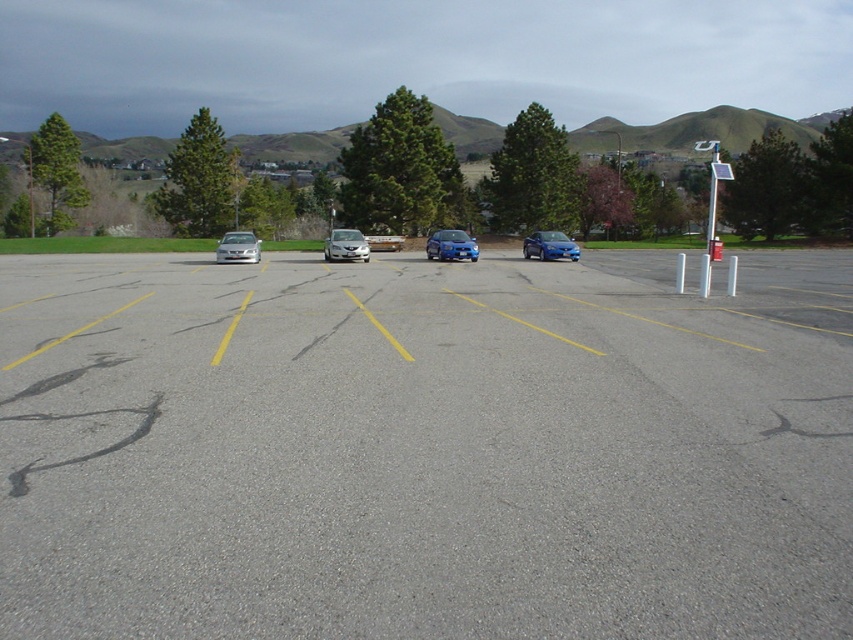
Does satin blue sedan at center appear under satin silver sedan at center?

No, satin blue sedan at center is not below satin silver sedan at center.

The width and height of the screenshot is (853, 640). What do you see at coordinates (451, 244) in the screenshot? I see `satin blue sedan at center` at bounding box center [451, 244].

Find the location of a particular element. This screenshot has width=853, height=640. satin blue sedan at center is located at coordinates (451, 244).

From the picture: Is metallic silver car at center shorter than silver metallic sedan at left?

Incorrect, metallic silver car at center's height does not fall short of silver metallic sedan at left's.

Which of these two, metallic silver car at center or silver metallic sedan at left, stands taller?

Standing taller between the two is metallic silver car at center.

The width and height of the screenshot is (853, 640). Identify the location of metallic silver car at center. (694, 131).

Is gray asphalt parking lot at center positioned in front of metallic silver car at center?

Yes, it is.

Consider the image. Measure the distance between gray asphalt parking lot at center and metallic silver car at center.

313.86 feet

What do you see at coordinates (421, 451) in the screenshot?
I see `gray asphalt parking lot at center` at bounding box center [421, 451].

The width and height of the screenshot is (853, 640). I want to click on gray asphalt parking lot at center, so click(x=421, y=451).